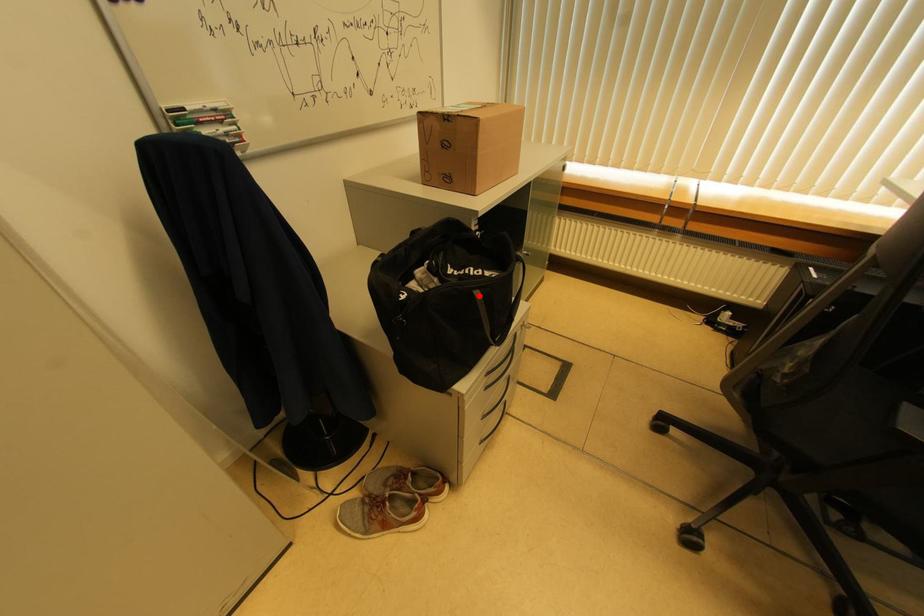
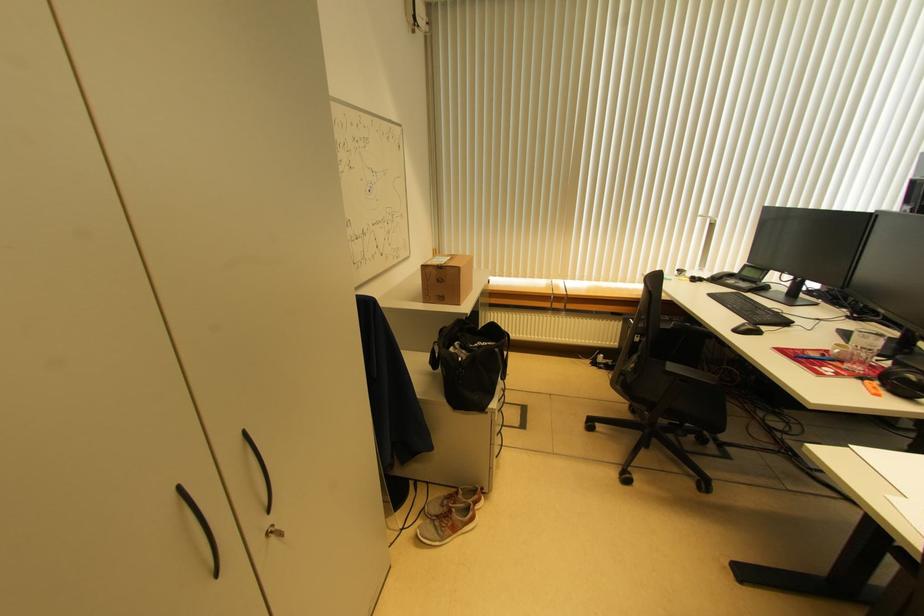
Find the pixel in the second image that matches the highlighted location in the first image.

(499, 353)